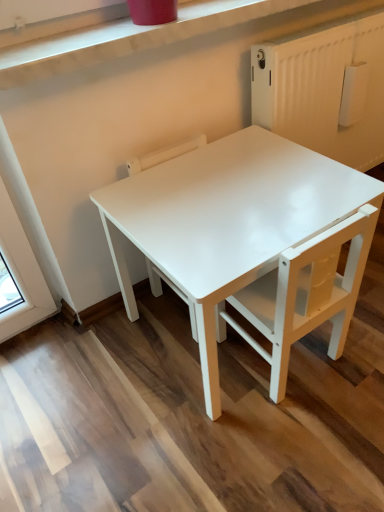
Question: Is white matte chair at center, which is the 2th chair in left-to-right order, inside the boundaries of white glossy chair at center, which appears as the first chair when viewed from the left, or outside?

Choices:
 (A) inside
 (B) outside

Answer: (B)

Question: From a real-world perspective, relative to white glossy chair at center, which appears as the first chair when viewed from the left, is white matte chair at center, which appears as the 1th chair when viewed from the right, vertically above or below?

Choices:
 (A) above
 (B) below

Answer: (B)

Question: Which object is positioned farthest from the white matte chair at center, which appears as the 1th chair when viewed from the right?

Choices:
 (A) white glossy table at center
 (B) white glossy chair at center, which appears as the first chair when viewed from the left

Answer: (B)

Question: Estimate the real-world distances between objects in this image. Which object is closer to the white glossy table at center?

Choices:
 (A) white matte chair at center, which is the 2th chair in left-to-right order
 (B) white glossy chair at center, which appears as the first chair when viewed from the left

Answer: (A)